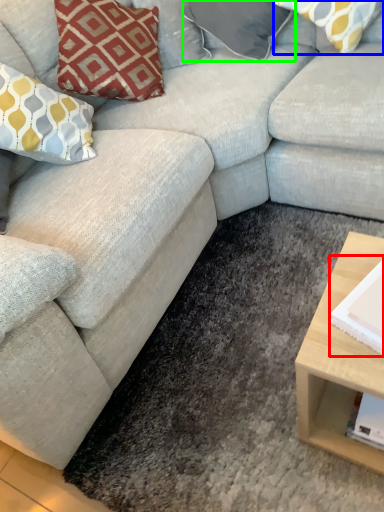
Question: Considering the real-world distances, which object is farthest from magazine (highlighted by a red box)? pillow (highlighted by a blue box) or pillow (highlighted by a green box)?

Choices:
 (A) pillow
 (B) pillow

Answer: (B)